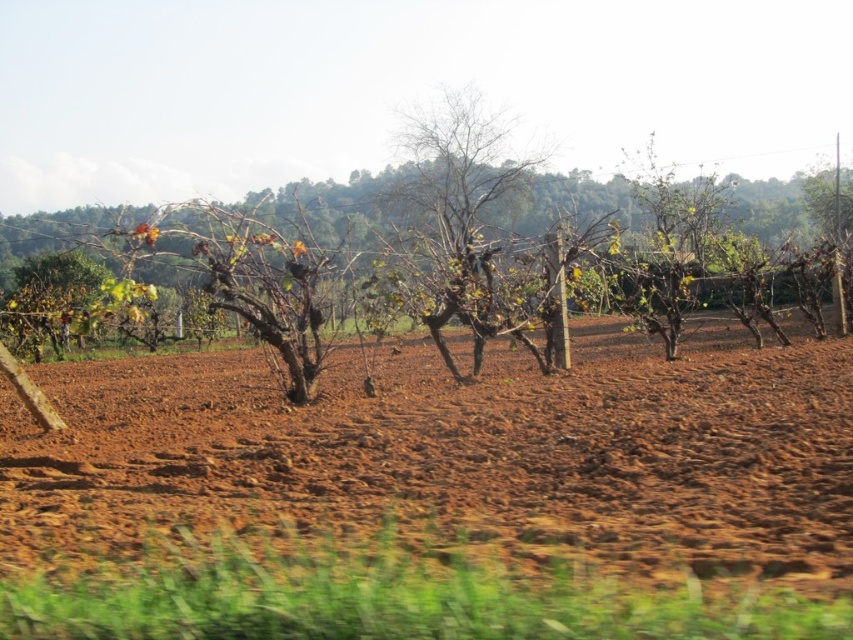
You are a farmer who needs to plant new grapevines in the vineyard. You observe the brown soil at center. Where exactly is the brown soil located in the image?

The brown soil at center is located at the coordinates point (456, 456) in the image.

You are a farmer checking the vineyard. You notice the brown soil at center and the brown bark tree at center. Which object is located lower in the image?

The brown soil at center is located lower than the brown bark tree at center in the image.

Based on the photo, you are standing in the vineyard shown in the image. There is a point marked at coordinates (456, 456). What is located at that point?

The point at coordinates (456, 456) marks brown soil at center.